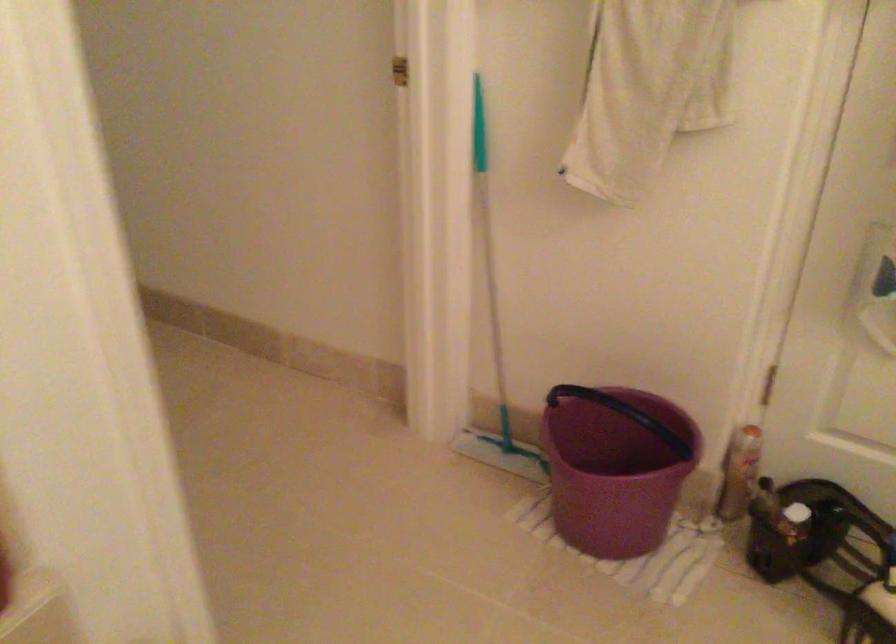
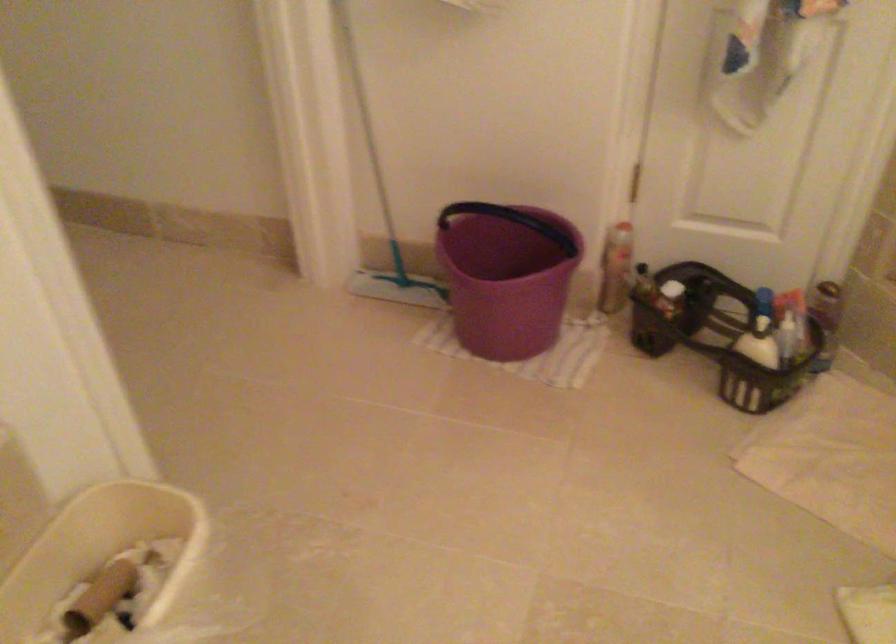
Question: The first image is from the beginning of the video and the second image is from the end. How did the camera likely rotate when shooting the video?

Choices:
 (A) Left
 (B) Right
 (C) Up
 (D) Down

Answer: (B)